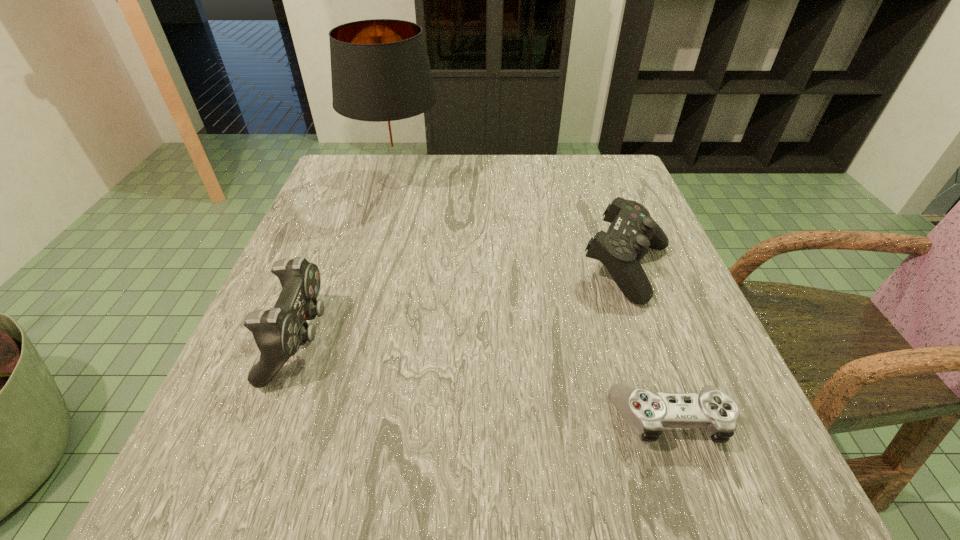
At what (x,y) coordinates should I click in order to perform the action: click on vacant region between the farthest object and the third tallest object. Please return your answer as a coordinate pair (x, y). The image size is (960, 540). Looking at the image, I should click on (512, 225).

Image resolution: width=960 pixels, height=540 pixels. What are the coordinates of `free space between the shortest control and the third shortest object` in the screenshot? It's located at (485, 380).

Point out which object is positioned as the second nearest to the leftmost control. Please provide its 2D coordinates. Your answer should be formatted as a tuple, i.e. [(x, y)], where the tuple contains the x and y coordinates of a point satisfying the conditions above.

[(647, 412)]

The image size is (960, 540). Find the location of `object that stands as the third closest to the tallest control`. object that stands as the third closest to the tallest control is located at coordinates (632, 231).

Identify which control is the third closest to the lampshade. Please provide its 2D coordinates. Your answer should be formatted as a tuple, i.e. [(x, y)], where the tuple contains the x and y coordinates of a point satisfying the conditions above.

[(647, 412)]

I want to click on control that is the second nearest to the leftmost control, so click(632, 231).

Where is `vacant space that satisfies the following two spatial constraints: 1. on the surface of the shortest control with buttons; 2. on the left side of the tallest control`? The height and width of the screenshot is (540, 960). vacant space that satisfies the following two spatial constraints: 1. on the surface of the shortest control with buttons; 2. on the left side of the tallest control is located at coordinates tap(270, 419).

Locate an element on the screen. This screenshot has width=960, height=540. vacant space that satisfies the following two spatial constraints: 1. on the surface of the leftmost control with buttons; 2. on the back side of the shortest control is located at coordinates (270, 419).

In order to click on vacant space that satisfies the following two spatial constraints: 1. on the surface of the leftmost control with buttons; 2. on the left side of the shortest object in this screenshot , I will do `click(270, 419)`.

This screenshot has width=960, height=540. Find the location of `free spot that satisfies the following two spatial constraints: 1. on the surface of the shortest object with buttons; 2. on the left side of the second tallest object`. free spot that satisfies the following two spatial constraints: 1. on the surface of the shortest object with buttons; 2. on the left side of the second tallest object is located at coordinates (270, 419).